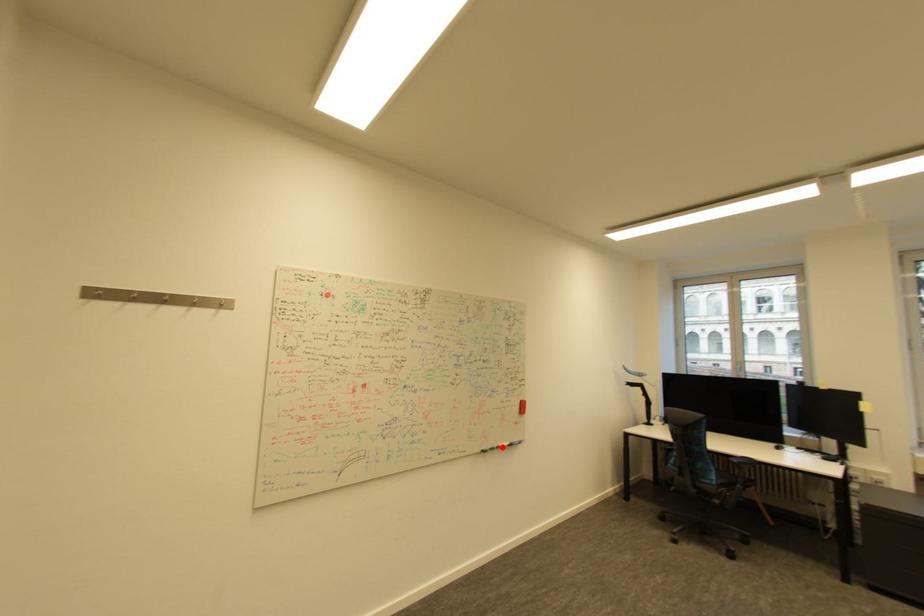
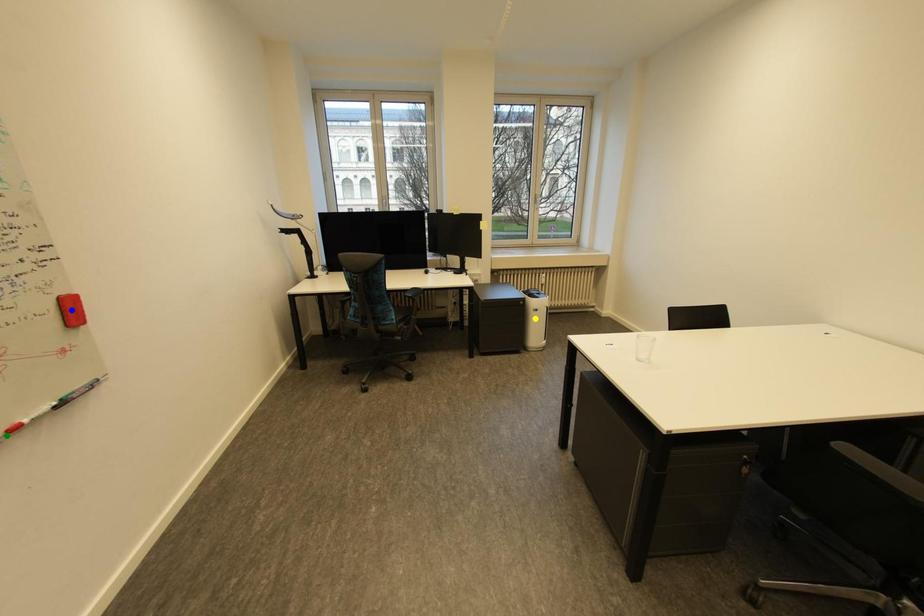
Question: I am providing you with two images of the same scene from different viewpoints. A red point is marked on the first image. You are given multiple points on the second image. Which mark in image 2 goes with the point in image 1?

Choices:
 (A) yellow point
 (B) green point
 (C) blue point

Answer: (B)